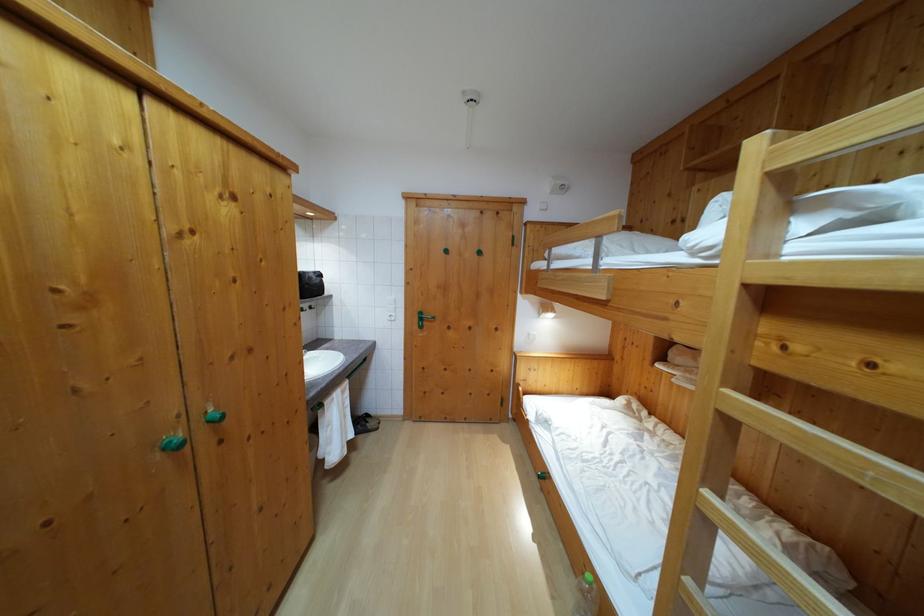
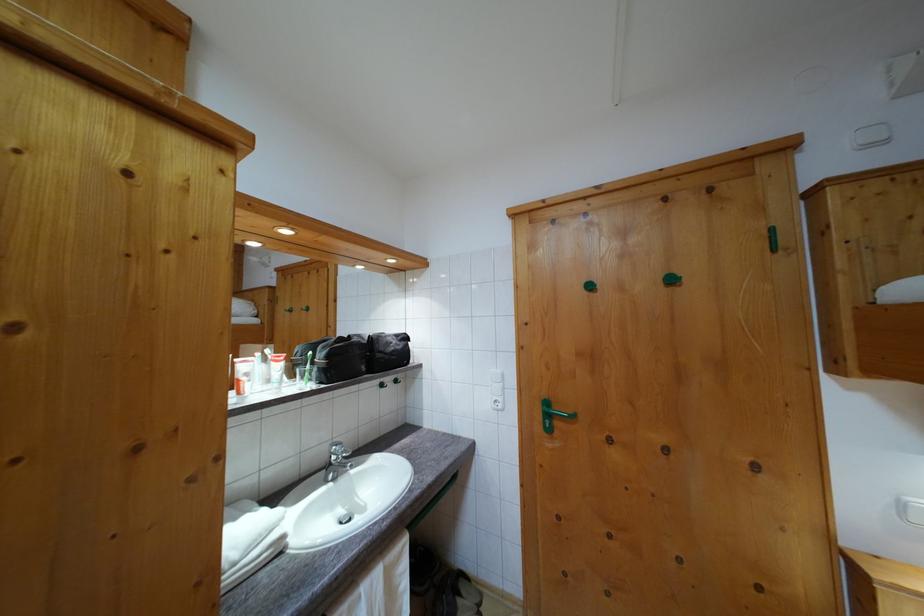
Find the pixel in the second image that matches the point at 424,320 in the first image.

(551, 410)